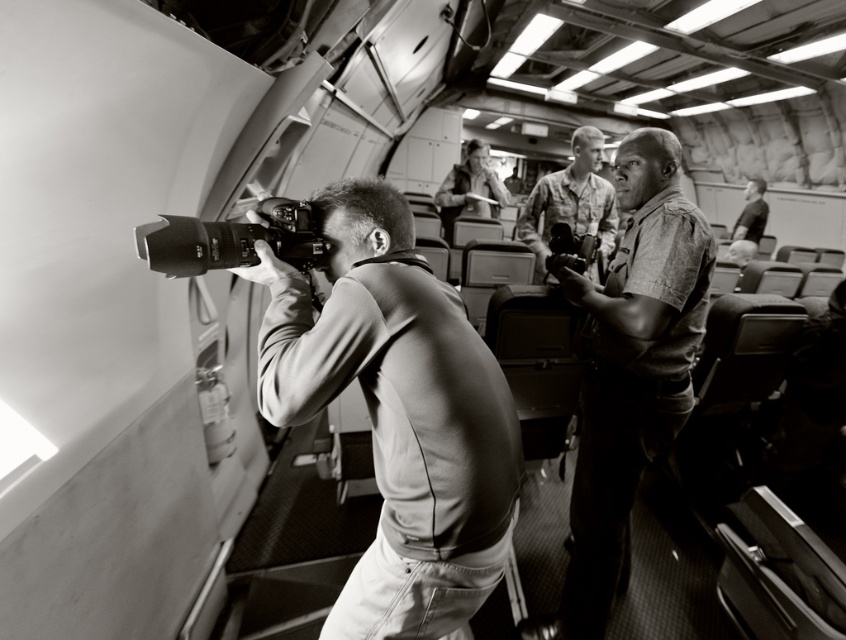
Question: Observing the image, what is the correct spatial positioning of smooth leather jacket at center in reference to camouflage uniform at center?

Choices:
 (A) left
 (B) right

Answer: (A)

Question: Can you confirm if smooth leather jacket at center is positioned above textured military uniform at center?

Choices:
 (A) no
 (B) yes

Answer: (B)

Question: Estimate the real-world distances between objects in this image. Which object is farther from the smooth leather jacket at center?

Choices:
 (A) metallic silver camera at center
 (B) metallic camera at center
 (C) camouflage uniform at center

Answer: (C)

Question: Which object appears closest to the camera in this image?

Choices:
 (A) metallic silver camera at center
 (B) smooth leather jacket at center
 (C) metallic camera at center
 (D) camouflage uniform at center

Answer: (A)

Question: Which object appears farthest from the camera in this image?

Choices:
 (A) metallic silver camera at center
 (B) smooth leather jacket at center
 (C) textured military uniform at center

Answer: (C)

Question: Observing the image, what is the correct spatial positioning of metallic silver camera at center in reference to camouflage uniform at center?

Choices:
 (A) left
 (B) right

Answer: (A)